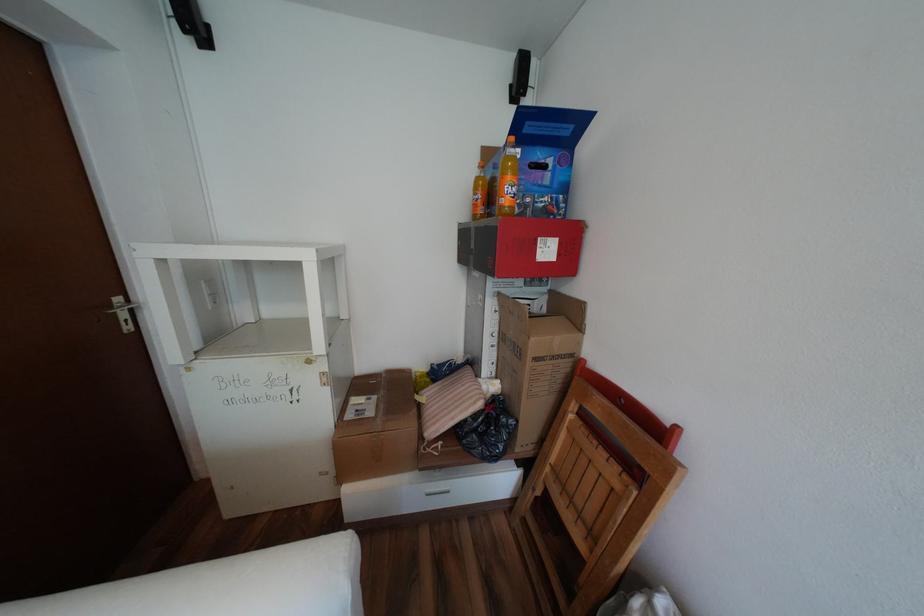
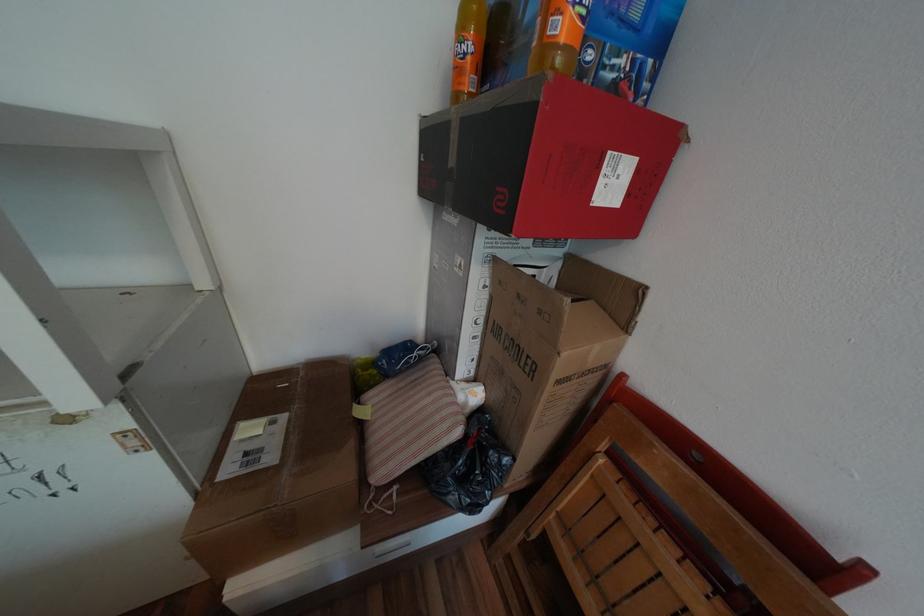
Find the pixel in the second image that matches (480,397) in the first image.

(453, 419)